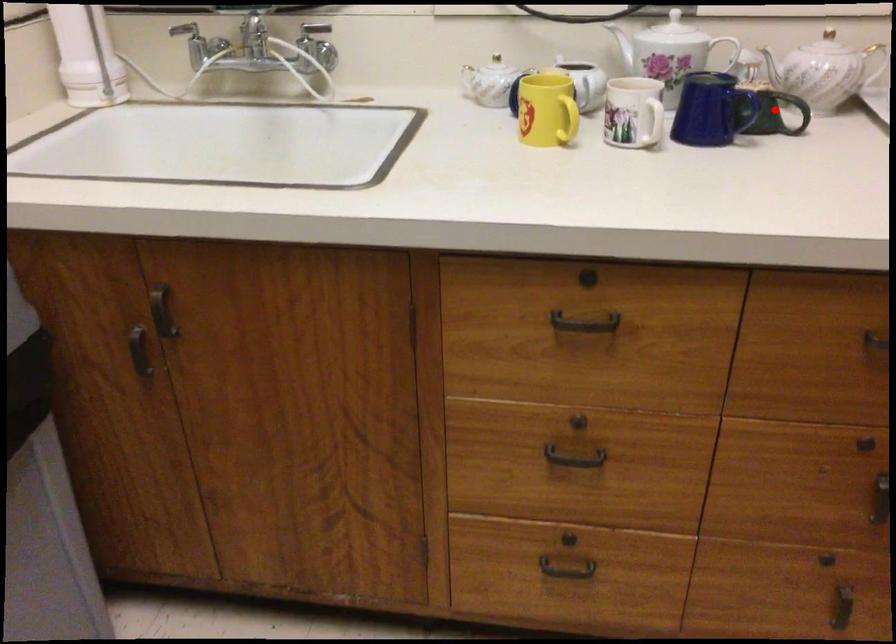
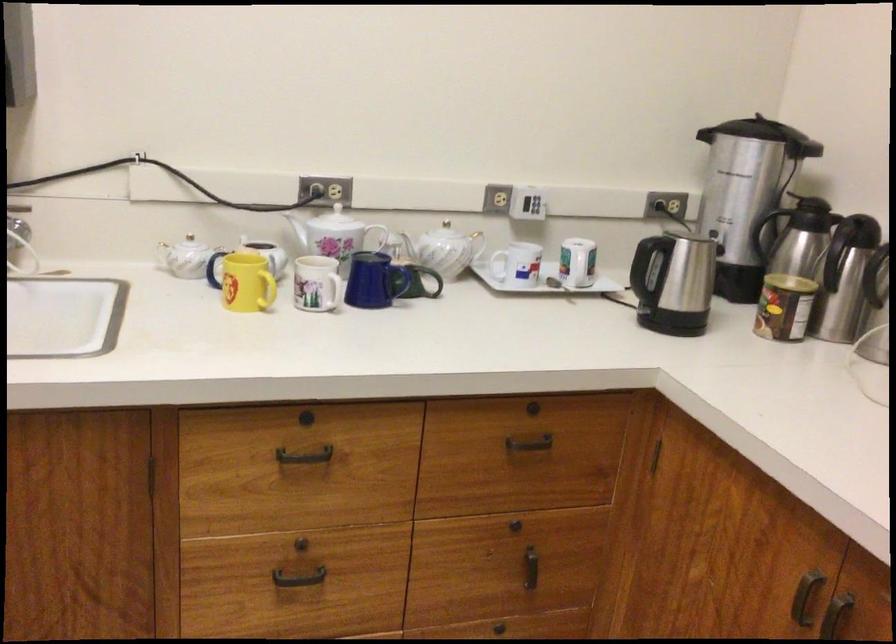
Question: I am providing you with two images of the same scene from different viewpoints. Image1 has a red point marked. In image2, the corresponding 3D location appears at what relative position? Reply with the corresponding letter.

Choices:
 (A) Closer
 (B) Farther

Answer: (B)